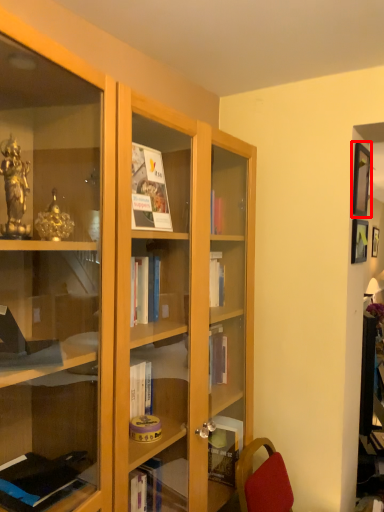
Question: From the image's perspective, where is picture frame (annotated by the red box) located in relation to picture frame in the image?

Choices:
 (A) above
 (B) below

Answer: (A)